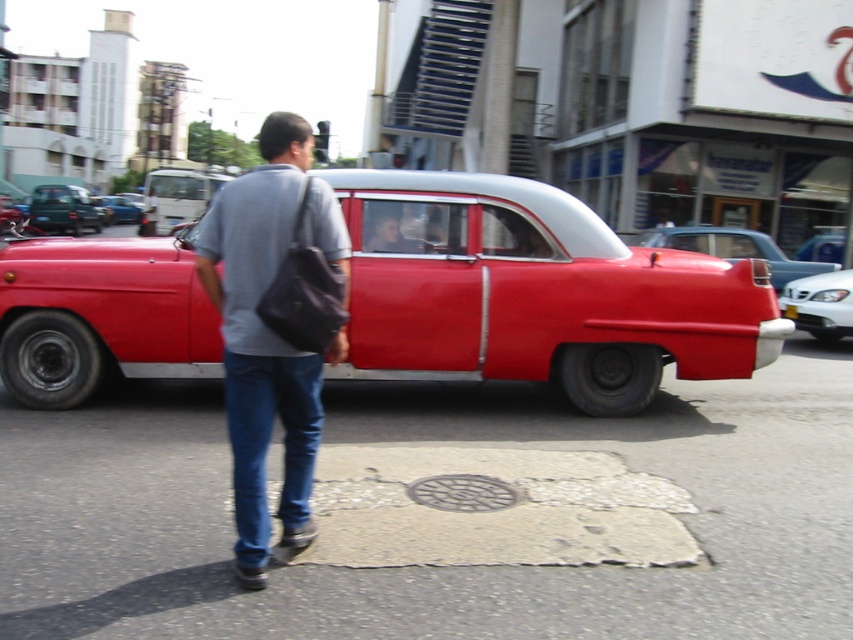
You are standing on the street and see two points marked on the ground. The first point is at coordinate point(115, 196) and the second point is at coordinate point(784, 308). Which point is closer to you?

Point(115, 196) is closer to you because it is further to the camera than point(784, 308).

You are standing at the point labeled point (106, 205) and want to walk to the point labeled point (781, 340). Given that the street has a cracked surface, which direction should you face to move towards your destination?

You should face towards the direction of the vintage red car with a white roof parked on the side of the road because point (781, 340) is in front of point (106, 205), indicating that moving towards the car would lead you in the correct direction.

From the picture: You are standing at the starting point and see two shiny red cars, the shiny red car at center and the shiny red car at right. Which one is closer to you?

The shiny red car at center is closer to you since it is only 22.55 feet away from the shiny red car at right, which is farther away.